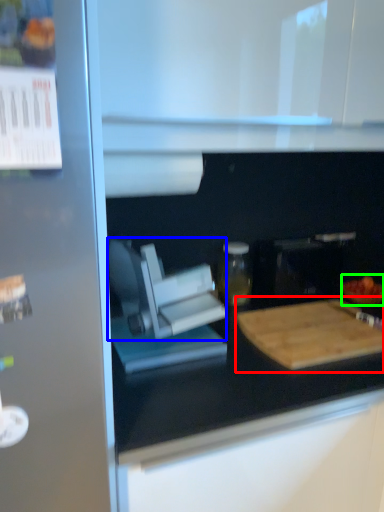
Question: Which object is positioned farthest from cutting board (highlighted by a red box)? Select from appliance (highlighted by a blue box) and food (highlighted by a green box).

Choices:
 (A) appliance
 (B) food

Answer: (A)